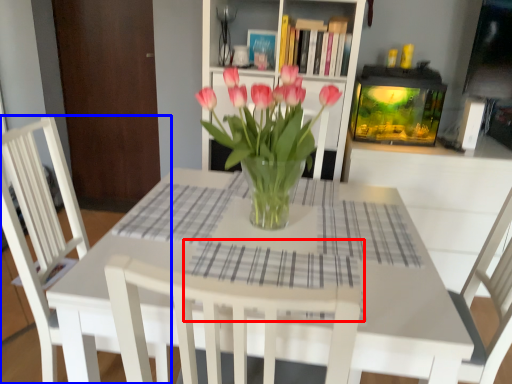
Question: Which object is closer to the camera taking this photo, plaid (highlighted by a red box) or chair (highlighted by a blue box)?

Choices:
 (A) plaid
 (B) chair

Answer: (A)